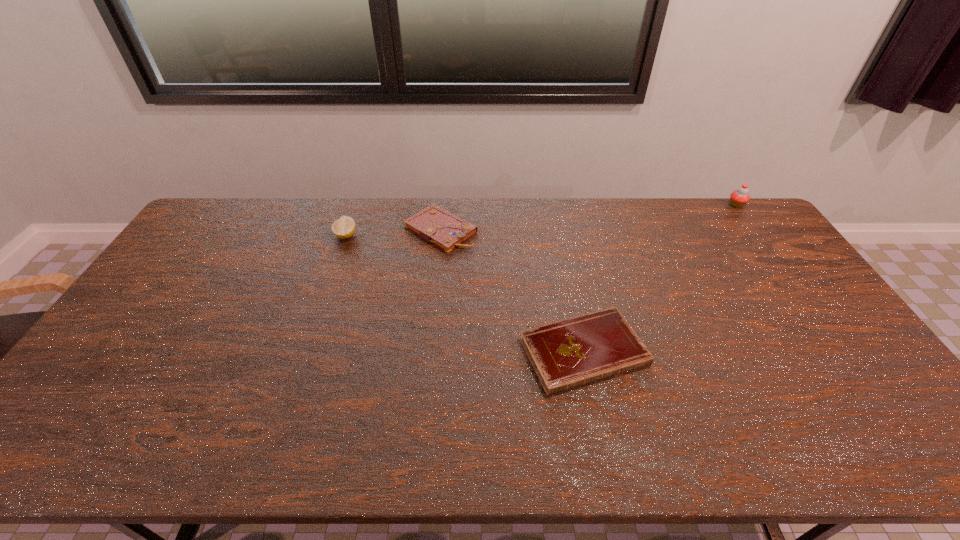
This screenshot has height=540, width=960. I want to click on blank region between the leftmost object and the third object from left to right, so click(465, 294).

The image size is (960, 540). Identify the location of free space between the leftmost object and the left notebook. (394, 233).

Identify the location of vacant region between the farther notebook and the shorter notebook. This screenshot has height=540, width=960. (513, 291).

This screenshot has width=960, height=540. In order to click on object identified as the second closest to the third object from right to left in this screenshot , I will do `click(570, 353)`.

Where is `object that can be found as the closest to the lemon`? This screenshot has height=540, width=960. object that can be found as the closest to the lemon is located at coordinates (434, 224).

Where is `blank space that satisfies the following two spatial constraints: 1. on the back side of the right notebook; 2. on the left side of the cupcake`? This screenshot has height=540, width=960. blank space that satisfies the following two spatial constraints: 1. on the back side of the right notebook; 2. on the left side of the cupcake is located at coordinates (553, 205).

Identify the location of vacant space that satisfies the following two spatial constraints: 1. on the front side of the right notebook; 2. on the right side of the second object from left to right. (428, 352).